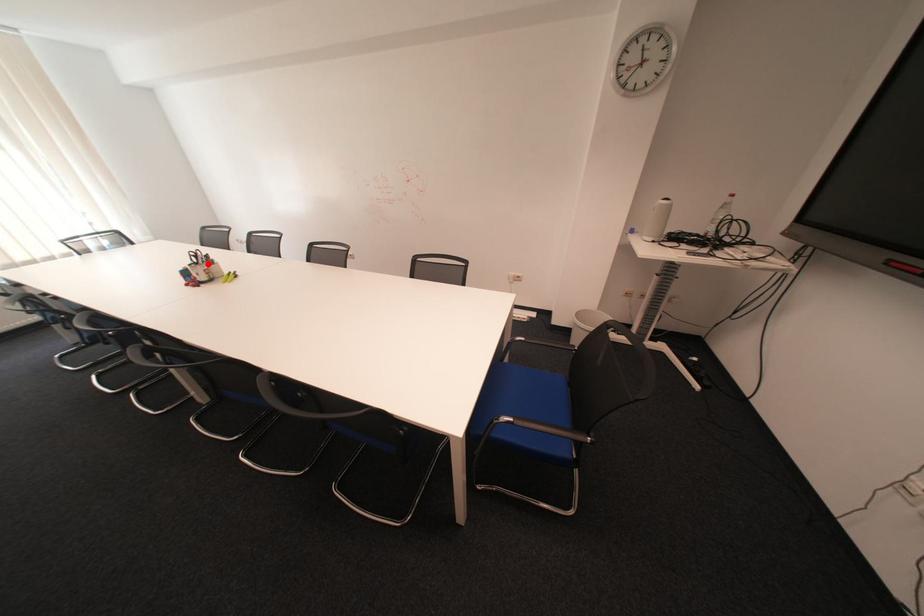
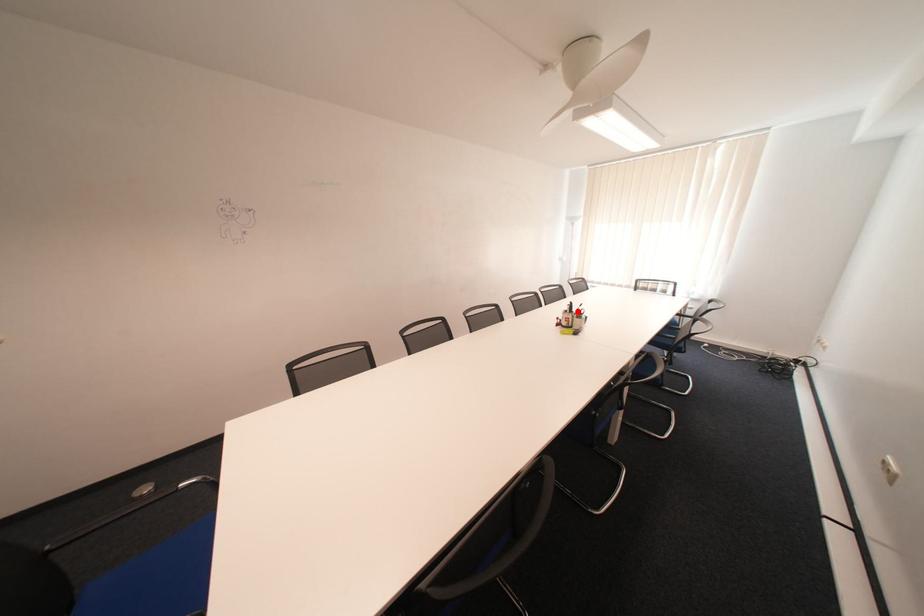
I am providing you with two images of the same scene from different viewpoints. A red point is marked on the first image and another point is marked on the second image. Are the points marked in image1 and image2 representing the same 3D position?

Yes